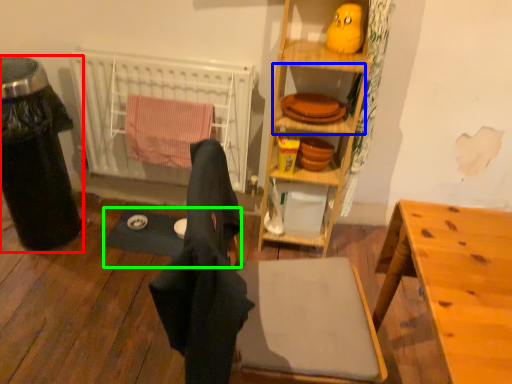
Question: Which object is the closest to the trash bin/can (highlighted by a red box)? Choose among these: shelf (highlighted by a blue box) or yoga mat (highlighted by a green box).

Choices:
 (A) shelf
 (B) yoga mat

Answer: (B)